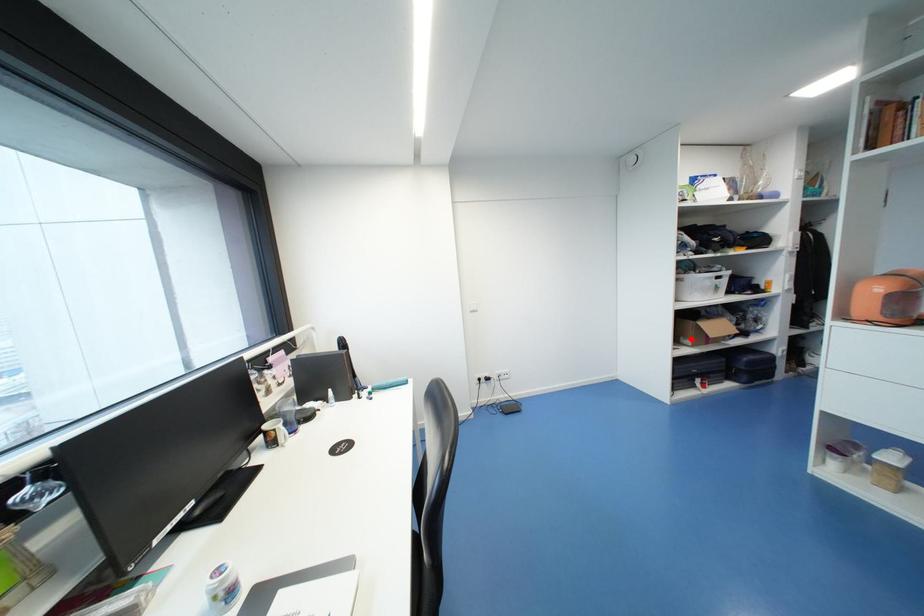
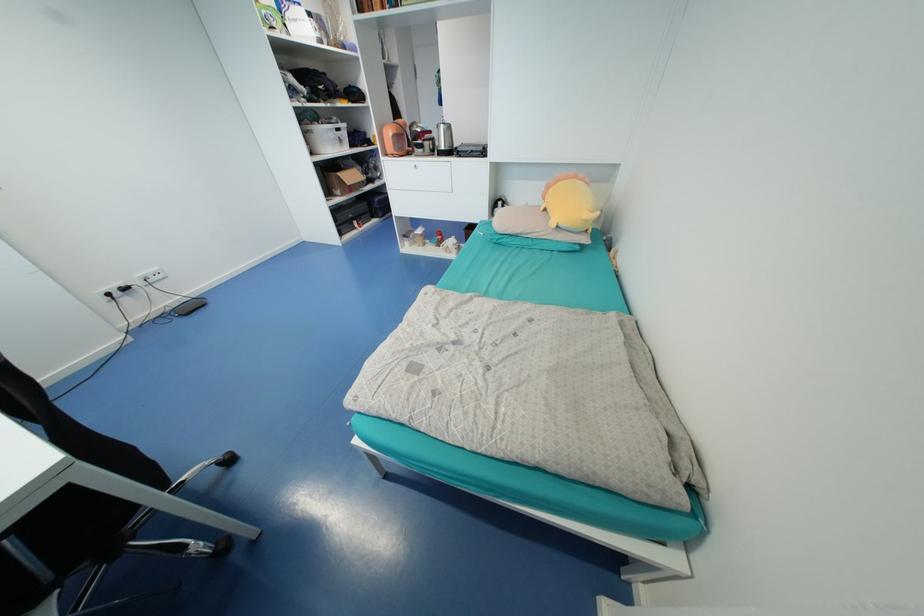
Find the pixel in the second image that matches the highlighted location in the first image.

(341, 190)